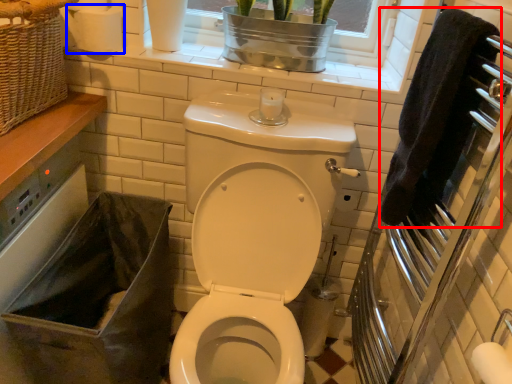
Question: Which object appears farthest to the camera in this image, hand towel (highlighted by a red box) or toilet paper (highlighted by a blue box)?

Choices:
 (A) hand towel
 (B) toilet paper

Answer: (B)